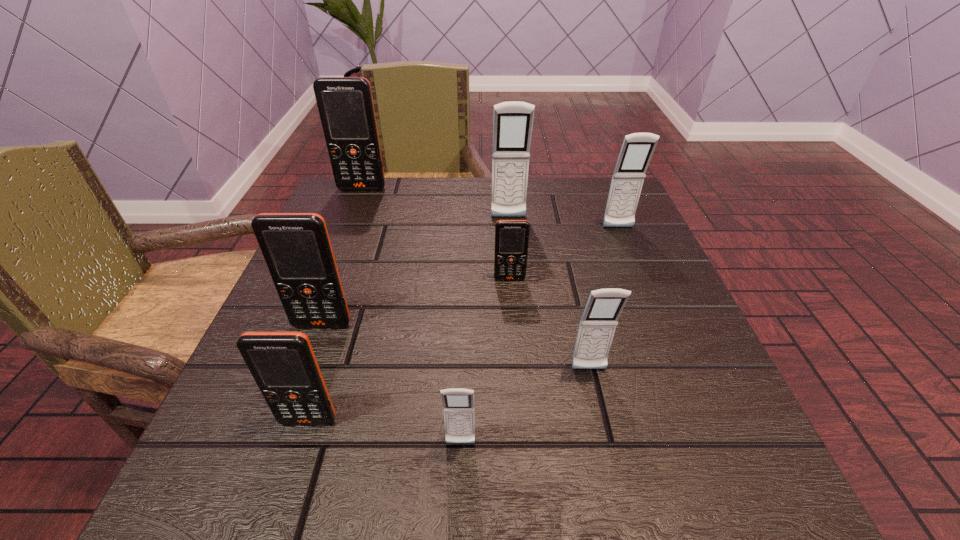
Choose which gray cellular telephone is the fourth nearest neighbor to the seventh farthest object. Please provide its 2D coordinates. Your answer should be formatted as a tuple, i.e. [(x, y)], where the tuple contains the x and y coordinates of a point satisfying the conditions above.

[(637, 149)]